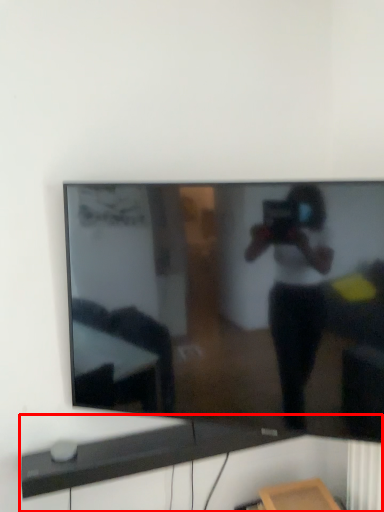
Question: Where is computer desk (annotated by the red box) located in relation to television in the image?

Choices:
 (A) left
 (B) right

Answer: (A)